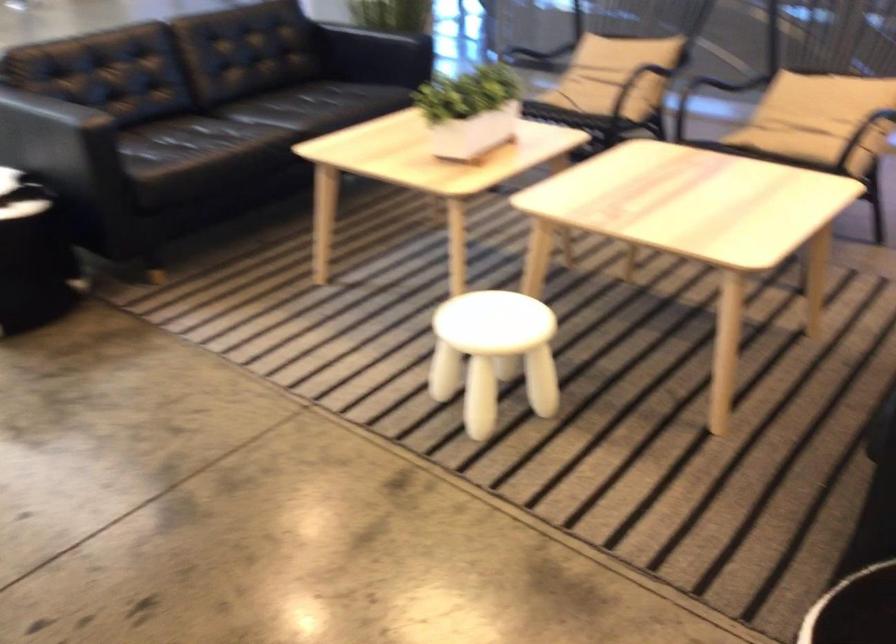
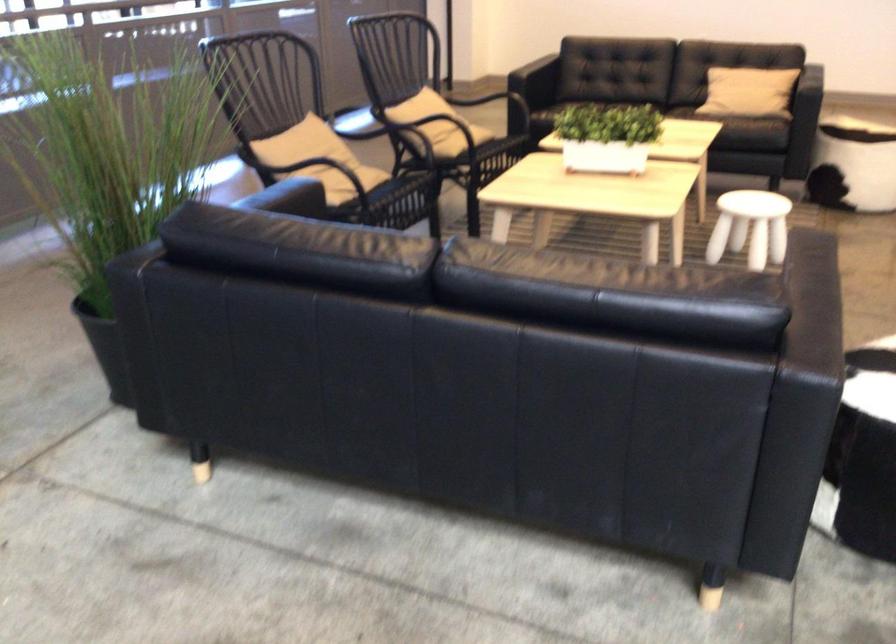
Where in the second image is the point corresponding to (459,328) from the first image?

(750, 227)